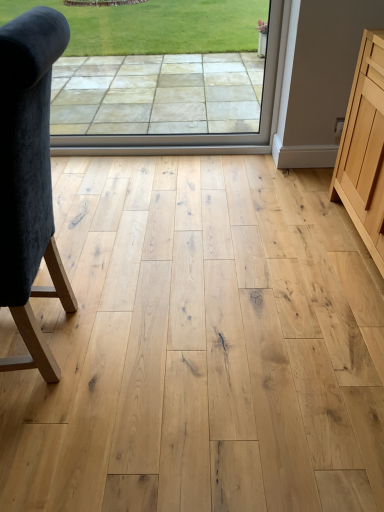
At what (x,y) coordinates should I click in order to perform the action: click on empty space that is in between transparent glass window at center and velvet dark blue chair at left. Please return your answer as a coordinate pair (x, y). The image size is (384, 512). Looking at the image, I should click on (144, 206).